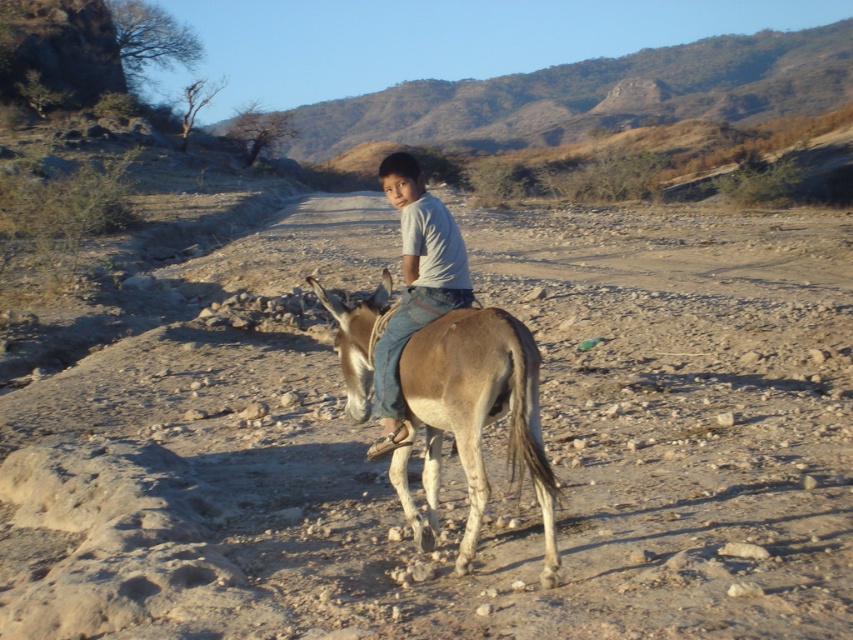
Can you confirm if light brown textured mule at center is thinner than light blue denim jeans at center?

Yes, light brown textured mule at center is thinner than light blue denim jeans at center.

Is light brown textured mule at center bigger than light blue denim jeans at center?

No.

This screenshot has height=640, width=853. Identify the location of light brown textured mule at center. (473, 419).

Can you confirm if brown sandy ground at center is taller than light blue denim jeans at center?

Indeed, brown sandy ground at center has a greater height compared to light blue denim jeans at center.

Locate an element on the screen. This screenshot has height=640, width=853. brown sandy ground at center is located at coordinates (450, 442).

Locate an element on the screen. brown sandy ground at center is located at coordinates (450, 442).

Which is in front, point (764, 396) or point (476, 344)?

Point (476, 344)

Does brown sandy ground at center have a larger size compared to light brown textured mule at center?

Indeed, brown sandy ground at center has a larger size compared to light brown textured mule at center.

Where is `brown sandy ground at center`? Image resolution: width=853 pixels, height=640 pixels. brown sandy ground at center is located at coordinates (450, 442).